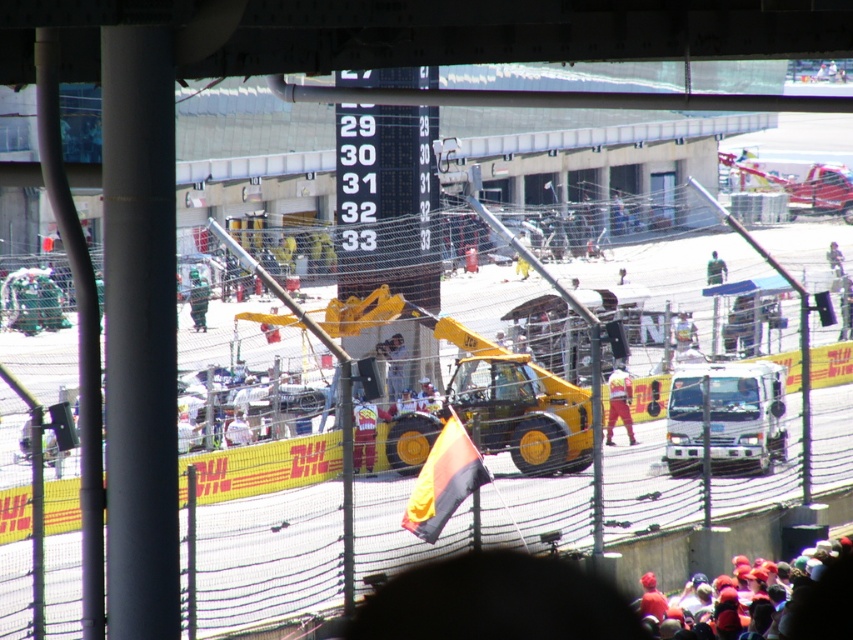
You are a photographer at the motorsport event. You need to capture a photo where both the green fabric person at center and the white fabric shirt at center are visible. Which object should you ensure is in the foreground to avoid blocking the other?

The green fabric person at center is taller than the white fabric shirt at center. To ensure both are visible, position the green fabric person at center in the foreground so its height doesn

In the scene shown: You are a photographer positioned at the front row of the motorsport event. You want to capture a photo of the white fabric shirt at center. Where should you aim your camera to ensure the shirt is in the frame?

You should aim your camera at point (236, 429) to capture the white fabric shirt at center.

From the picture: You are a photographer at the motorsport event. You want to take a photo of the green fabric person at center and the white fabric shirt at center. Which one should you focus on first if you want to capture both in the same frame without moving the camera?

The green fabric person at center is above the white fabric shirt at center, so you should focus on the green fabric person at center first to ensure both are in the frame.